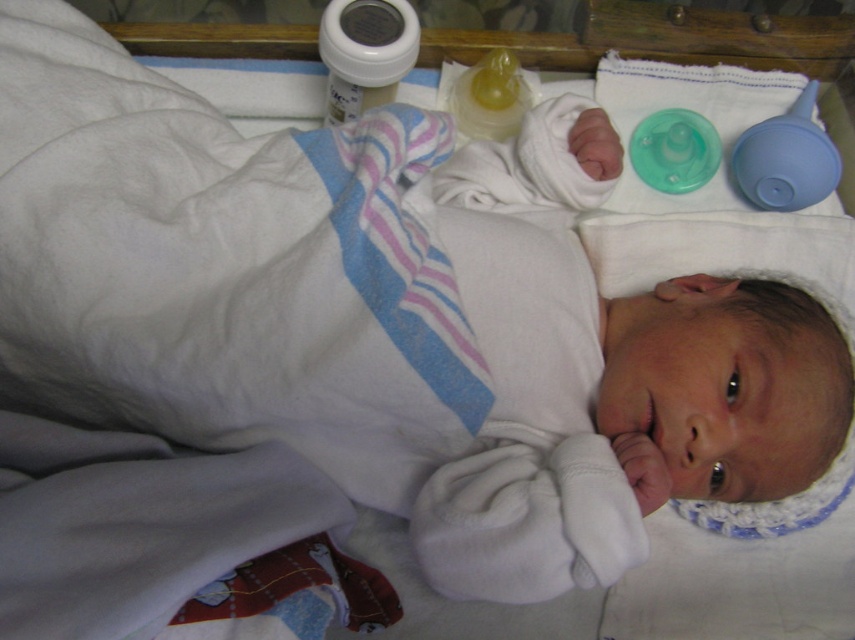
Is white plastic bottle at upper center positioned behind green rubber teether at upper right?

No, it is in front of green rubber teether at upper right.

Is white plastic bottle at upper center thinner than green rubber teether at upper right?

No, white plastic bottle at upper center is not thinner than green rubber teether at upper right.

Identify the location of white plastic bottle at upper center. (364, 52).

Which of these two, blue rubber pacifier at upper right or green rubber teether at upper right, stands shorter?

green rubber teether at upper right is shorter.

This screenshot has height=640, width=855. I want to click on blue rubber pacifier at upper right, so click(x=786, y=157).

Is green rubber teether at upper right behind translucent yellow baby bottle at upper center?

Yes, it is.

Can you confirm if green rubber teether at upper right is positioned to the left of translucent yellow baby bottle at upper center?

In fact, green rubber teether at upper right is to the right of translucent yellow baby bottle at upper center.

You are a GUI agent. You are given a task and a screenshot of the screen. Output one action in this format:
    pyautogui.click(x=<x>, y=<y>)
    Task: Click on the green rubber teether at upper right
    Image resolution: width=855 pixels, height=640 pixels.
    Given the screenshot: What is the action you would take?
    pyautogui.click(x=674, y=150)

You are a GUI agent. You are given a task and a screenshot of the screen. Output one action in this format:
    pyautogui.click(x=<x>, y=<y>)
    Task: Click on the green rubber teether at upper right
    The width and height of the screenshot is (855, 640).
    Given the screenshot: What is the action you would take?
    pyautogui.click(x=674, y=150)